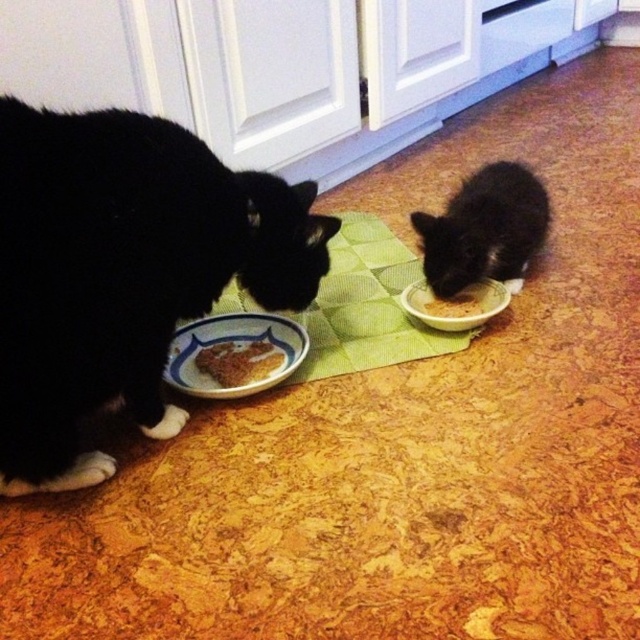
Question: Which of the following is the farthest from the observer?

Choices:
 (A) brown matte bowl at center
 (B) black glossy cat at left

Answer: (A)

Question: Does green fabric mat at center come behind brown matte bowl at center?

Choices:
 (A) yes
 (B) no

Answer: (B)

Question: Considering the relative positions of black glossy cat at left and black matte fur cat at lower right in the image provided, where is black glossy cat at left located with respect to black matte fur cat at lower right?

Choices:
 (A) left
 (B) right

Answer: (A)

Question: Which object is positioned farthest from the black glossy cat at left?

Choices:
 (A) green fabric mat at center
 (B) brown crumbly food at lower left

Answer: (B)

Question: Can you confirm if green fabric mat at center is wider than brown crumbly food at lower left?

Choices:
 (A) no
 (B) yes

Answer: (B)

Question: Which is farther from the white glossy plate at lower left?

Choices:
 (A) brown crumbly food at lower left
 (B) black glossy cat at left
 (C) brown matte bowl at center
 (D) black matte fur cat at lower right

Answer: (D)